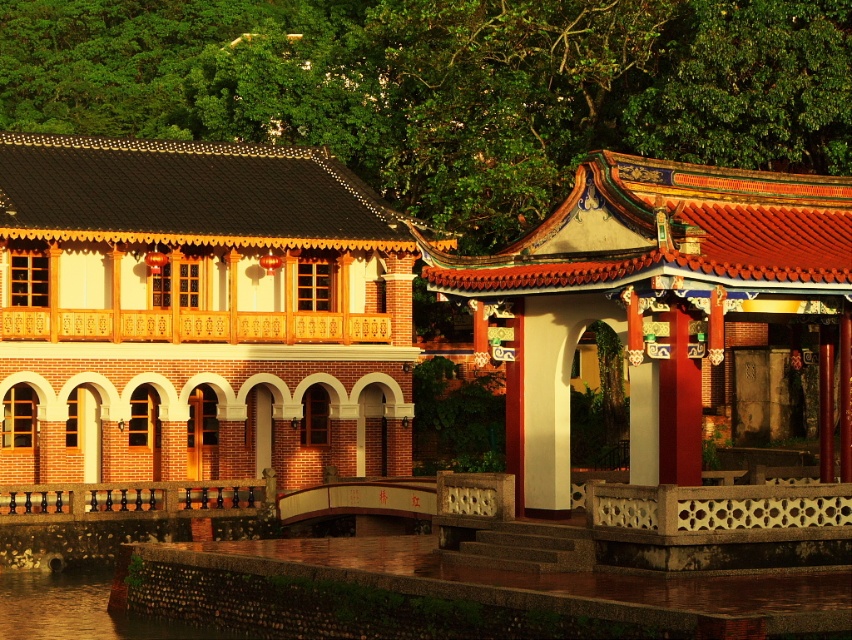
Does brick building at left appear on the left side of reddish-brown stone gazebo at right?

Yes, brick building at left is to the left of reddish-brown stone gazebo at right.

You are a GUI agent. You are given a task and a screenshot of the screen. Output one action in this format:
    pyautogui.click(x=<x>, y=<y>)
    Task: Click on the brick building at left
    
    Given the screenshot: What is the action you would take?
    pyautogui.click(x=199, y=314)